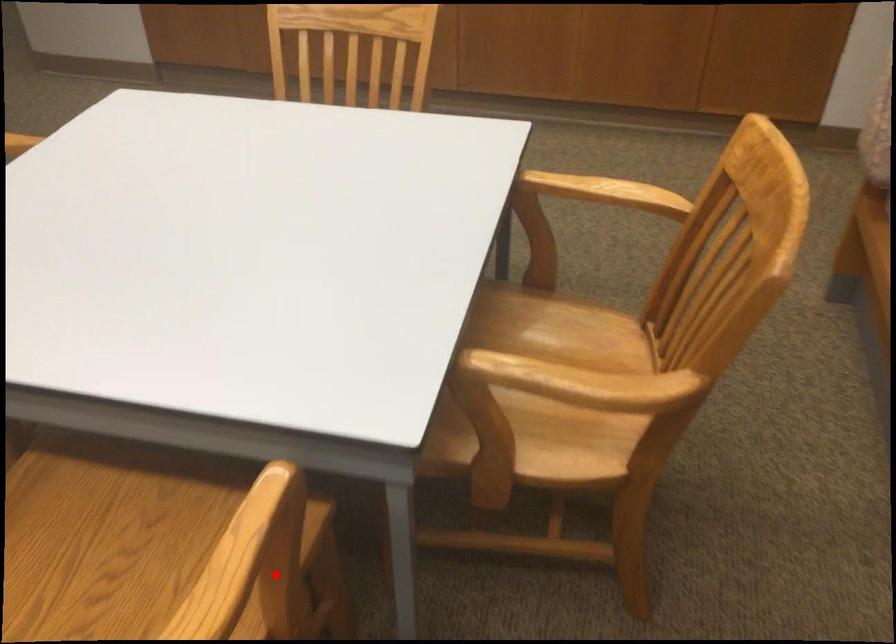
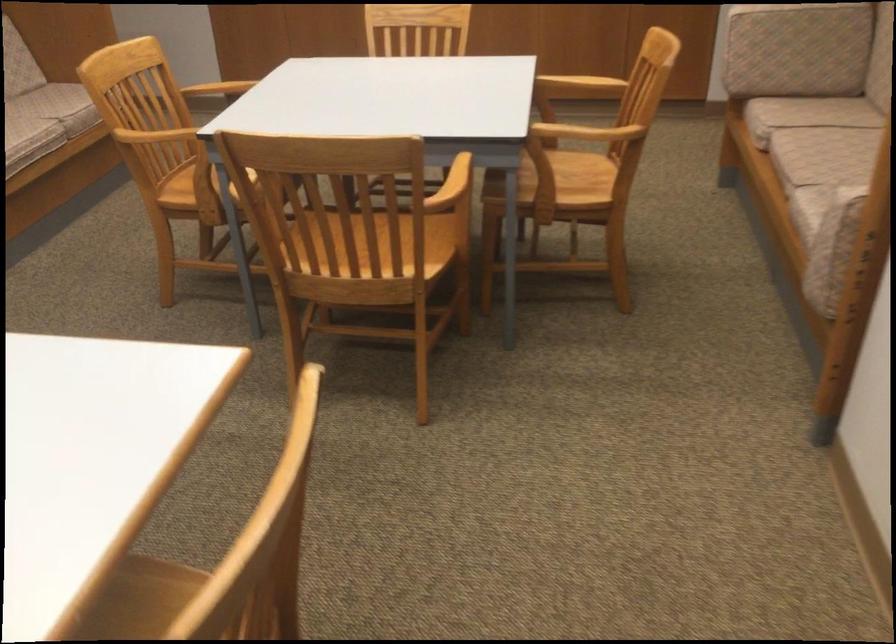
Locate, in the second image, the point that corresponds to the highlighted location in the first image.

(470, 174)